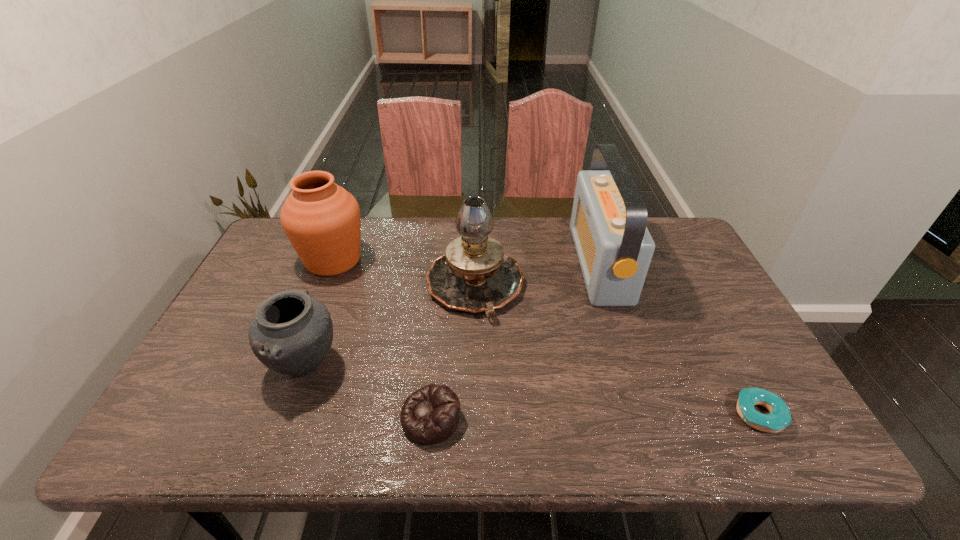
This screenshot has width=960, height=540. In the image, there is a desktop. What are the coordinates of `vacant space at the near right corner` in the screenshot? It's located at (766, 444).

This screenshot has width=960, height=540. Identify the location of free space that is in between the beanbag and the rightmost object. (595, 416).

Image resolution: width=960 pixels, height=540 pixels. In order to click on free space that is in between the beanbag and the fourth tallest object in this screenshot , I will do `click(369, 392)`.

What are the coordinates of `free area in between the rightmost object and the oil lamp` in the screenshot? It's located at (616, 350).

I want to click on vacant area between the fifth object from left to right and the shortest object, so 679,339.

The height and width of the screenshot is (540, 960). Find the location of `free point between the second object from right to left and the oil lamp`. free point between the second object from right to left and the oil lamp is located at coordinates (538, 275).

I want to click on vacant region between the oil lamp and the farther urn, so click(404, 273).

You are a GUI agent. You are given a task and a screenshot of the screen. Output one action in this format:
    pyautogui.click(x=<x>, y=<y>)
    Task: Click on the free space between the shortest object and the farther urn
    The width and height of the screenshot is (960, 540).
    Given the screenshot: What is the action you would take?
    pyautogui.click(x=546, y=338)

The image size is (960, 540). I want to click on empty space between the doughnut and the radio receiver, so click(679, 339).

What are the coordinates of `empty location between the shortest object and the shorter urn` in the screenshot? It's located at (532, 390).